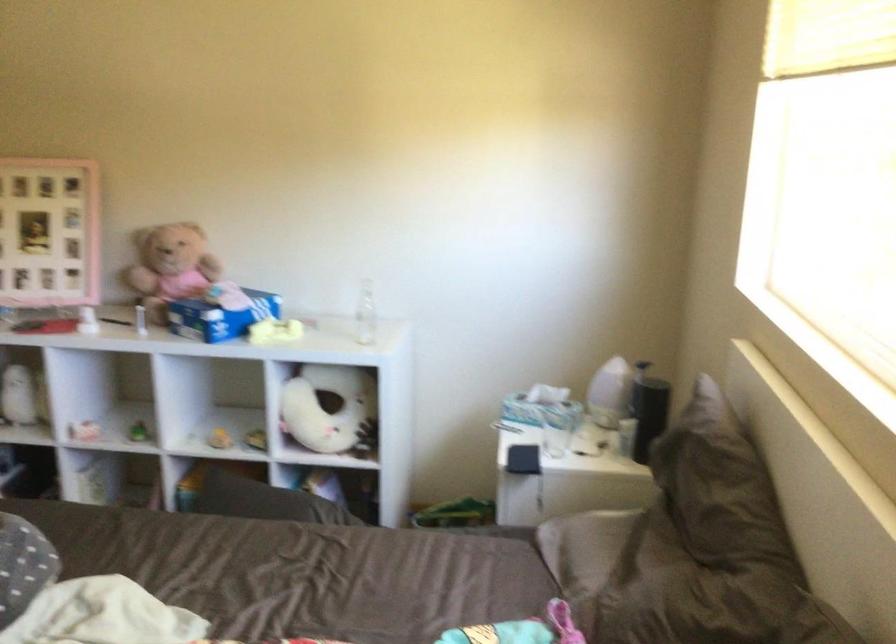
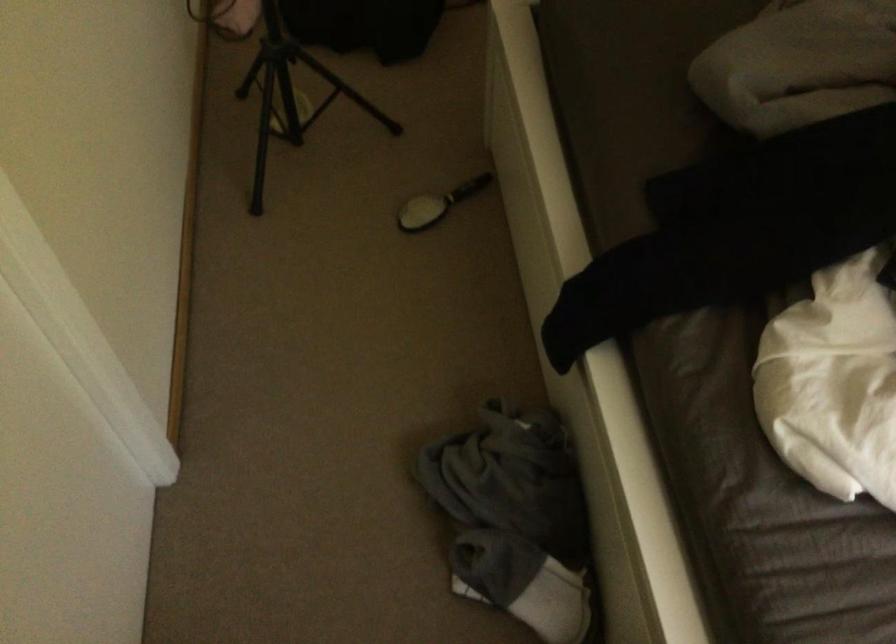
First-person continuous shooting, in which direction is the camera rotating?

The camera rotated toward left-down.